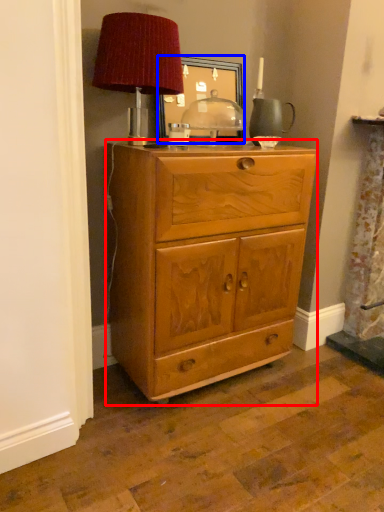
Question: Which point is closer to the camera, chest of drawers (highlighted by a red box) or picture frame (highlighted by a blue box)?

Choices:
 (A) chest of drawers
 (B) picture frame

Answer: (A)